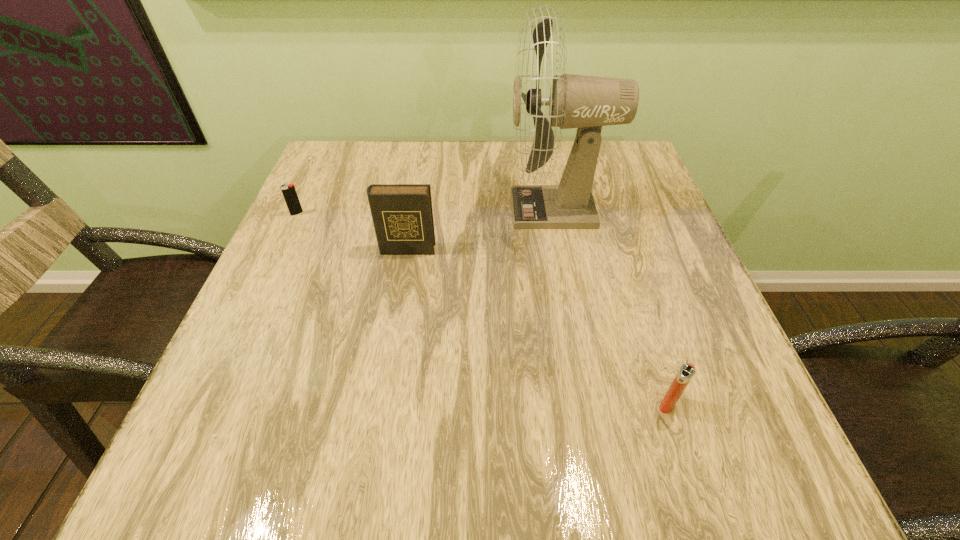
The image size is (960, 540). Find the location of `vacant space at the left edge of the desktop`. vacant space at the left edge of the desktop is located at coordinates (280, 311).

Identify the location of free space at the right edge of the desktop. This screenshot has height=540, width=960. (612, 255).

The width and height of the screenshot is (960, 540). In order to click on vacant space at the far left corner of the desktop in this screenshot , I will do `click(346, 161)`.

This screenshot has height=540, width=960. I want to click on free space at the far right corner, so click(597, 182).

You are a GUI agent. You are given a task and a screenshot of the screen. Output one action in this format:
    pyautogui.click(x=<x>, y=<y>)
    Task: Click on the unoccupied area between the right igniter and the diary
    The image size is (960, 540).
    Given the screenshot: What is the action you would take?
    pyautogui.click(x=538, y=327)

This screenshot has width=960, height=540. In order to click on free spot between the fan and the second tallest object in this screenshot , I will do `click(482, 230)`.

Identify the location of vacant space that's between the right igniter and the second tallest object. (538, 327).

Where is `free point between the third shortest object and the fan`? The width and height of the screenshot is (960, 540). free point between the third shortest object and the fan is located at coordinates (482, 230).

Identify the location of vacant area between the second object from left to right and the nearer igniter. (538, 327).

Where is `vacant area that lies between the tallest object and the second object from left to right`? This screenshot has height=540, width=960. vacant area that lies between the tallest object and the second object from left to right is located at coordinates click(482, 230).